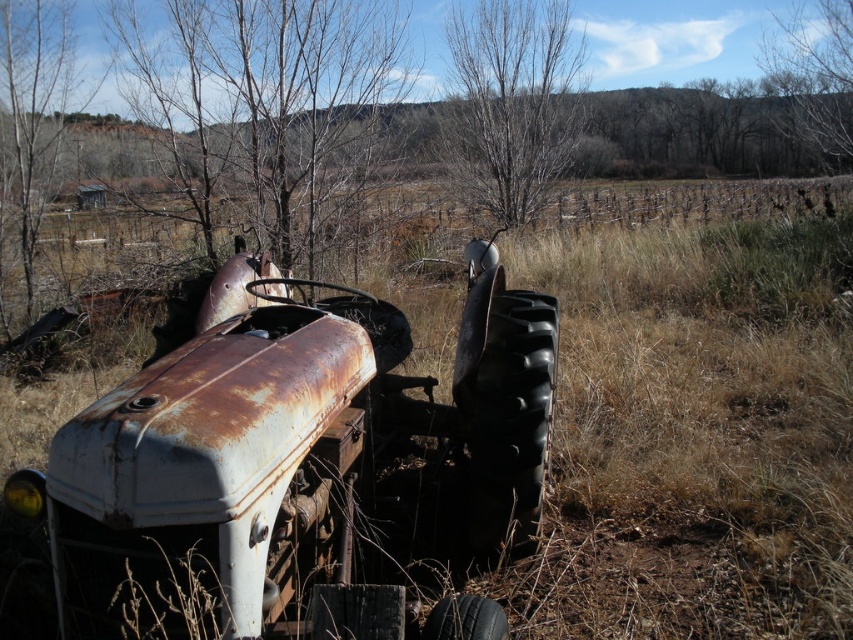
Which is below, rusty metal tractor at center or bare branches at upper right?

Positioned lower is rusty metal tractor at center.

Who is taller, rusty metal tractor at center or bare branches at upper right?

With more height is bare branches at upper right.

Describe the element at coordinates (283, 467) in the screenshot. This screenshot has height=640, width=853. I see `rusty metal tractor at center` at that location.

Where is `rusty metal tractor at center`? rusty metal tractor at center is located at coordinates (283, 467).

From the picture: Who is higher up, rusty metal tractor at center or bare branches at upper left?

bare branches at upper left is higher up.

Is point (235, 465) positioned before point (328, 22)?

Yes.

The height and width of the screenshot is (640, 853). What are the coordinates of `rusty metal tractor at center` in the screenshot? It's located at (283, 467).

Is the position of bare branches at upper left more distant than that of bare branches at center?

No, bare branches at upper left is closer to the viewer.

Who is shorter, bare branches at upper left or bare branches at center?

bare branches at upper left is shorter.

The height and width of the screenshot is (640, 853). Describe the element at coordinates (267, 104) in the screenshot. I see `bare branches at upper left` at that location.

Find the location of a particular element. bare branches at upper left is located at coordinates (267, 104).